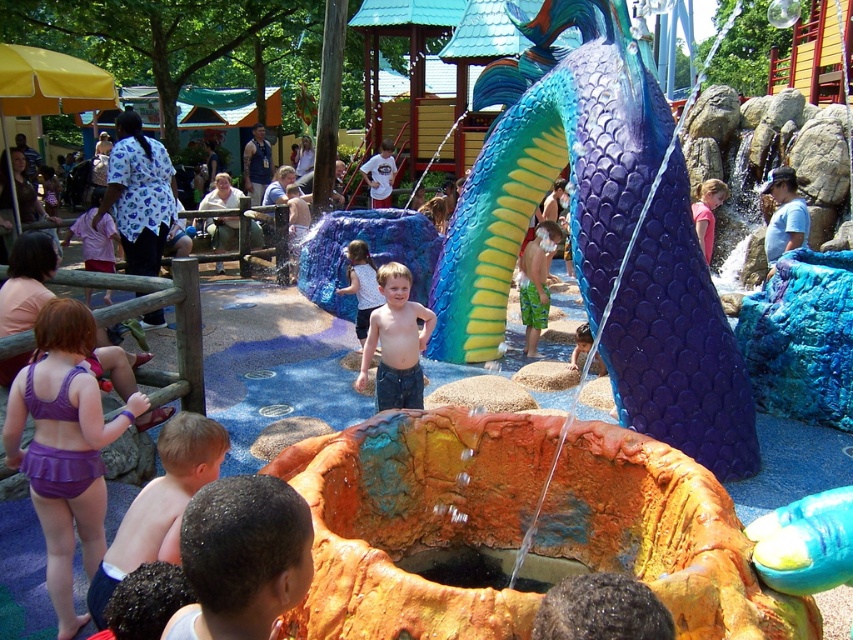
How far apart are shiny blue scales at center and purple fabric swimsuit at lower left?

shiny blue scales at center and purple fabric swimsuit at lower left are 3.74 meters apart.

Does shiny blue scales at center have a greater width compared to purple fabric swimsuit at lower left?

Indeed, shiny blue scales at center has a greater width compared to purple fabric swimsuit at lower left.

Is point (672, 266) behind point (61, 458)?

Yes, point (672, 266) is behind point (61, 458).

I want to click on shiny blue scales at center, so click(x=550, y=168).

Is shiny black hair at center smaller than smooth purple shorts at lower left?

Indeed, shiny black hair at center has a smaller size compared to smooth purple shorts at lower left.

Can you confirm if shiny black hair at center is shorter than smooth purple shorts at lower left?

Yes, shiny black hair at center is shorter than smooth purple shorts at lower left.

Does point (219, 493) come behind point (190, 433)?

No, it is in front of (190, 433).

Find the location of a particular element. shiny black hair at center is located at coordinates (242, 557).

Which is above, shiny blue scales at center or shiny blue shorts at center?

shiny blue scales at center is above.

Does shiny blue scales at center have a greater width compared to shiny blue shorts at center?

Indeed, shiny blue scales at center has a greater width compared to shiny blue shorts at center.

Is point (570, 99) less distant than point (415, 332)?

No, (570, 99) is behind (415, 332).

In order to click on shiny blue scales at center in this screenshot , I will do `click(550, 168)`.